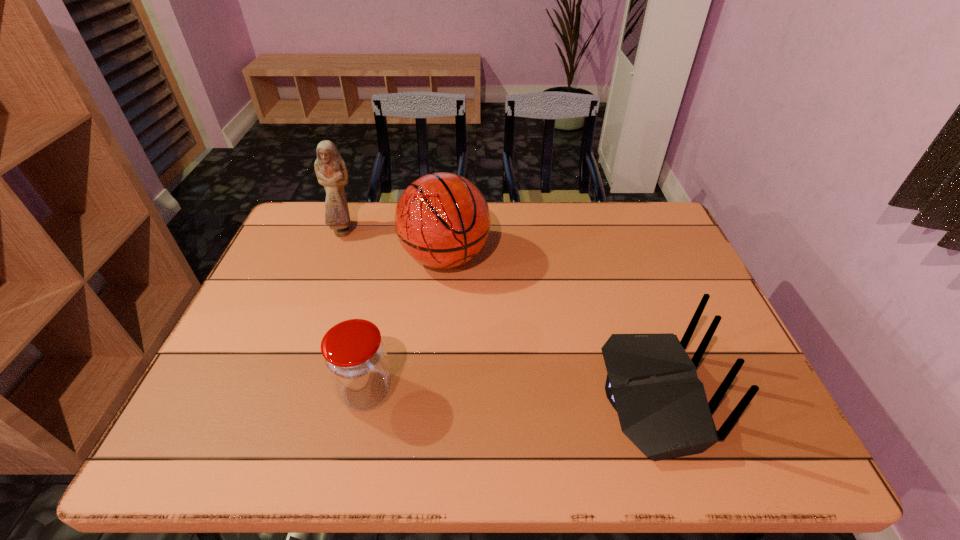
Identify the location of jar. The width and height of the screenshot is (960, 540). (354, 355).

Identify the location of the rightmost object. The width and height of the screenshot is (960, 540). (652, 383).

What are the coordinates of `basketball` in the screenshot? It's located at (442, 220).

Locate an element on the screen. The image size is (960, 540). the leftmost object is located at coordinates (330, 168).

The image size is (960, 540). In order to click on vacant space located 0.060m on the left of the jar in this screenshot , I will do `click(312, 392)`.

Where is `vacant space located 0.400m on the side with spill of the basketball`? vacant space located 0.400m on the side with spill of the basketball is located at coordinates (521, 403).

Locate an element on the screen. vacant space situated 0.050m on the side with spill of the basketball is located at coordinates (467, 298).

You are a GUI agent. You are given a task and a screenshot of the screen. Output one action in this format:
    pyautogui.click(x=<x>, y=<y>)
    Task: Click on the free space located 0.230m on the side with spill of the basketball
    
    Given the screenshot: What is the action you would take?
    pyautogui.click(x=492, y=347)

You are a GUI agent. You are given a task and a screenshot of the screen. Output one action in this format:
    pyautogui.click(x=<x>, y=<y>)
    Task: Click on the vacant region located on the front-facing side of the leftmost object
    
    Given the screenshot: What is the action you would take?
    pyautogui.click(x=375, y=274)

The width and height of the screenshot is (960, 540). I want to click on free space located on the front-facing side of the leftmost object, so click(363, 258).